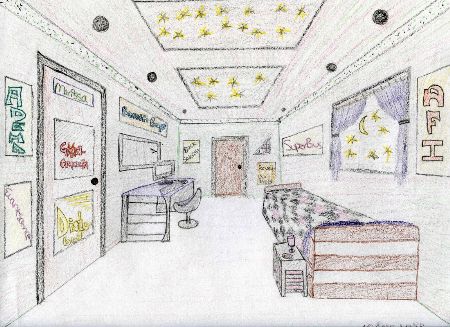
At what (x,y) coordinates should I click in order to perform the action: click on door. Please return your answer as a coordinate pair (x, y). This screenshot has width=450, height=327. Looking at the image, I should click on (232, 178).